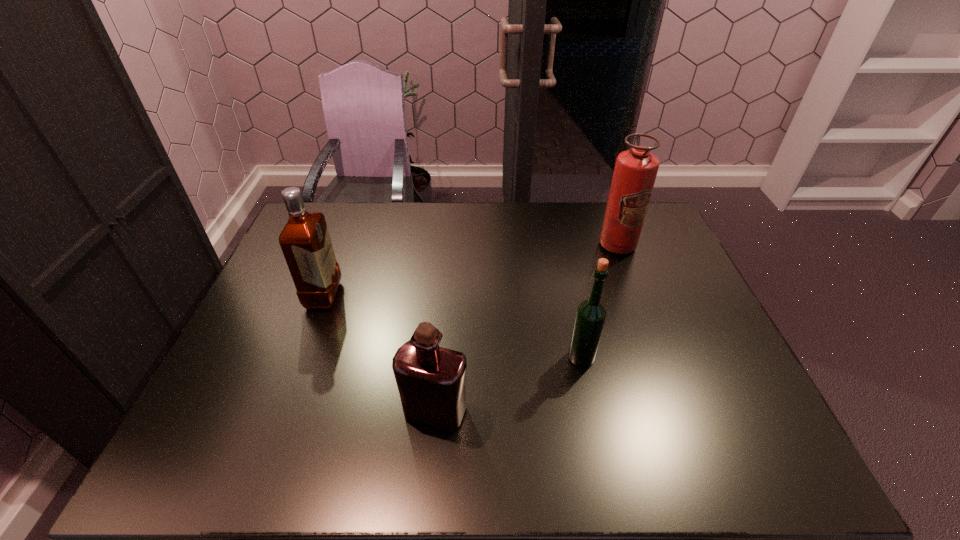
Where is `free space at the far left corner of the desktop`? The width and height of the screenshot is (960, 540). free space at the far left corner of the desktop is located at coordinates (330, 224).

This screenshot has height=540, width=960. Identify the location of free space at the near left corner. (206, 457).

The width and height of the screenshot is (960, 540). Find the location of `vacant point located between the rightmost liquor and the third object from right to left`. vacant point located between the rightmost liquor and the third object from right to left is located at coordinates (508, 384).

Locate an element on the screen. The image size is (960, 540). empty space between the nearest object and the second nearest liquor is located at coordinates (508, 384).

The width and height of the screenshot is (960, 540). I want to click on vacant point located between the nearest object and the third farthest object, so (508, 384).

You are a GUI agent. You are given a task and a screenshot of the screen. Output one action in this format:
    pyautogui.click(x=<x>, y=<y>)
    Task: Click on the free spot between the leftmost liquor and the second farthest liquor
    This screenshot has height=540, width=960.
    Given the screenshot: What is the action you would take?
    pyautogui.click(x=452, y=327)

Find the location of a particular element. The image size is (960, 540). free space between the fire extinguisher and the second farthest object is located at coordinates (470, 271).

Locate an element on the screen. The image size is (960, 540). empty space that is in between the second liquor from right to left and the second object from right to left is located at coordinates (508, 384).

Locate an element on the screen. The height and width of the screenshot is (540, 960). free space that is in between the second liquor from left to right and the farthest liquor is located at coordinates (379, 353).

The height and width of the screenshot is (540, 960). I want to click on free spot between the fire extinguisher and the leftmost object, so click(x=470, y=271).